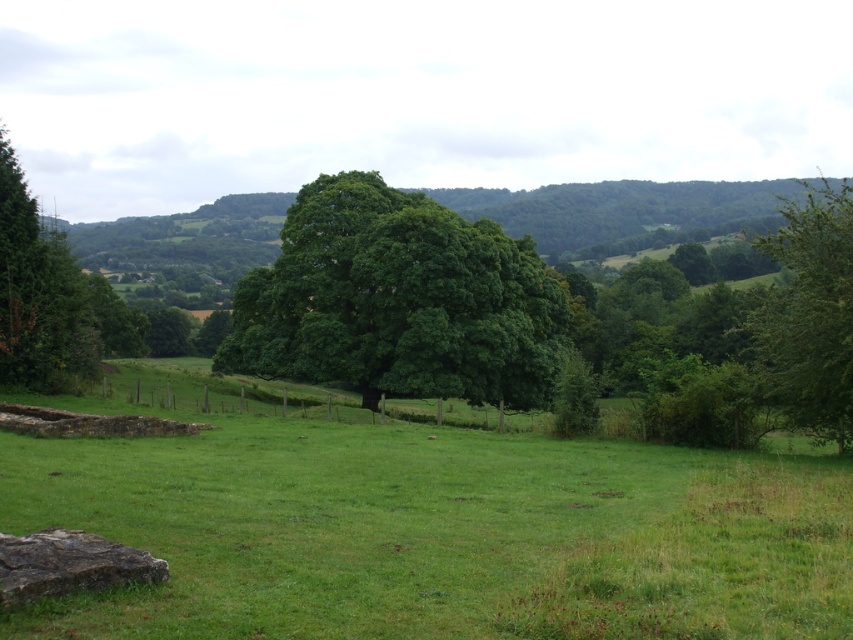
Does green leafy tree at center have a smaller size compared to green leafy tree at right?

Indeed, green leafy tree at center has a smaller size compared to green leafy tree at right.

Does point (398, 202) come closer to viewer compared to point (811, 300)?

No, (398, 202) is behind (811, 300).

The image size is (853, 640). Identify the location of green leafy tree at center. (398, 300).

Where is `green leafy tree at center`? This screenshot has width=853, height=640. green leafy tree at center is located at coordinates (398, 300).

How far apart are green grass at center and green leafy tree at right?

green grass at center is 19.73 meters from green leafy tree at right.

Looking at this image, is green grass at center to the right of green leafy tree at right from the viewer's perspective?

Incorrect, green grass at center is not on the right side of green leafy tree at right.

Is point (503, 560) farther from camera compared to point (788, 410)?

No, it is not.

You are a GUI agent. You are given a task and a screenshot of the screen. Output one action in this format:
    pyautogui.click(x=<x>, y=<y>)
    Task: Click on the green grass at center
    This screenshot has width=853, height=640.
    Given the screenshot: What is the action you would take?
    pos(436,532)

Does green grass at center appear over green leafy tree at center?

Actually, green grass at center is below green leafy tree at center.

Does point (56, 470) come in front of point (357, 364)?

Yes, point (56, 470) is closer to viewer.

At what (x,y) coordinates should I click in order to perform the action: click on green grass at center. Please return your answer as a coordinate pair (x, y). The image size is (853, 640). Looking at the image, I should click on (436, 532).